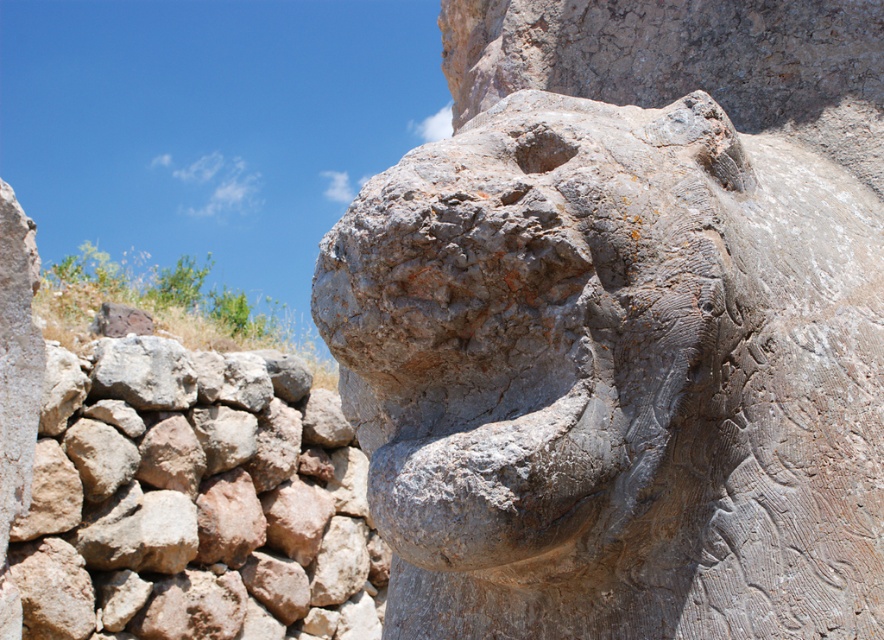
Who is more forward, (164, 582) or (115, 344)?

Positioned in front is point (115, 344).

Does rustic stone wall at left appear on the right side of gray rough rock at lower left?

Indeed, rustic stone wall at left is positioned on the right side of gray rough rock at lower left.

The image size is (884, 640). Find the location of `rustic stone wall at left`. rustic stone wall at left is located at coordinates (193, 500).

Is gray stone lion head at center to the left of rustic stone wall at left from the viewer's perspective?

No, gray stone lion head at center is not to the left of rustic stone wall at left.

Looking at this image, can you confirm if gray stone lion head at center is thinner than rustic stone wall at left?

Correct, gray stone lion head at center's width is less than rustic stone wall at left's.

Where is `gray stone lion head at center`? gray stone lion head at center is located at coordinates (615, 376).

Is gray stone lion head at center wider than gray rough rock at lower left?

Correct, the width of gray stone lion head at center exceeds that of gray rough rock at lower left.

Does gray stone lion head at center appear under gray rough rock at lower left?

No.

Is point (623, 141) closer to camera compared to point (123, 394)?

That is True.

The width and height of the screenshot is (884, 640). In order to click on gray stone lion head at center in this screenshot , I will do `click(615, 376)`.